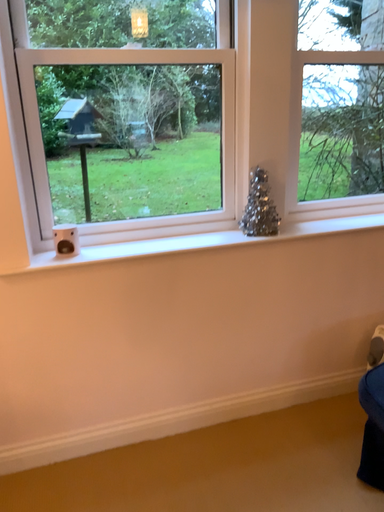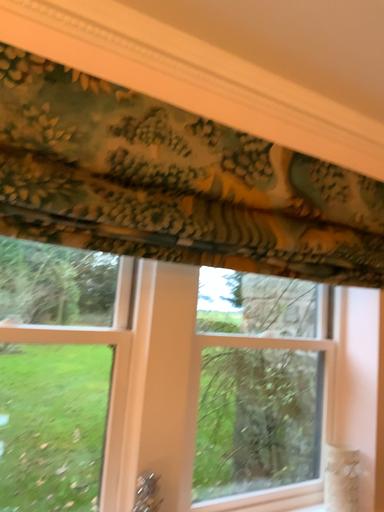
Question: How did the camera likely rotate when shooting the video?

Choices:
 (A) rotated right
 (B) rotated left

Answer: (A)